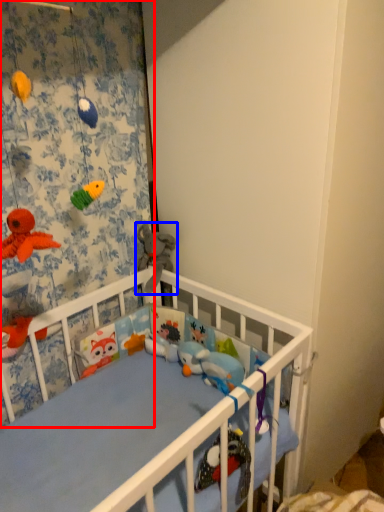
Question: Which object appears farthest to the camera in this image, curtain (highlighted by a red box) or toy (highlighted by a blue box)?

Choices:
 (A) curtain
 (B) toy

Answer: (B)